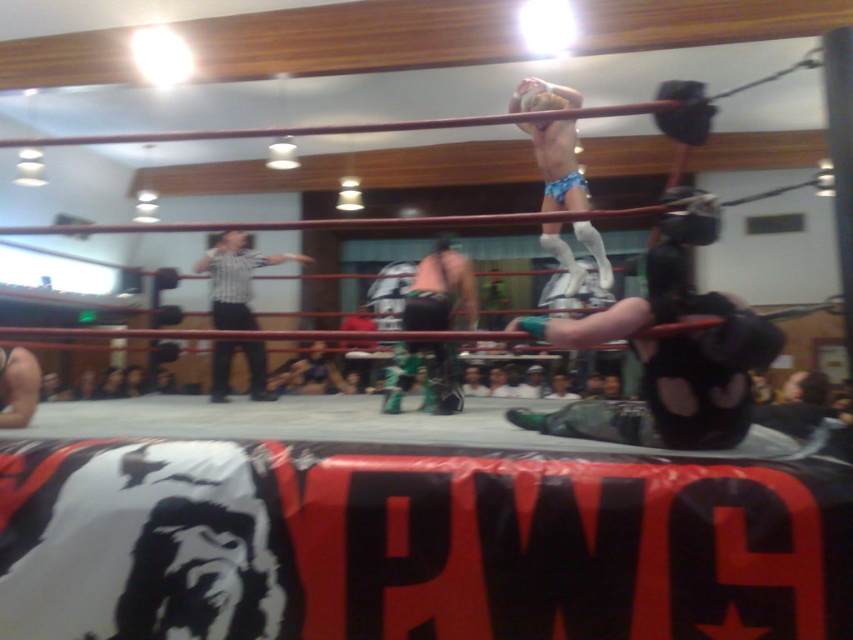
You are a referee in a wrestling match. You see the green fabric pants at center and the striped shirt at center. Which one is positioned higher in the image?

The green fabric pants at center is above the striped shirt at center, so the green fabric pants at center is positioned higher.

You are a referee in a wrestling match and need to determine which wrestler is closer to the ropes. Based on the scene, which wrestler is positioned closer to the ropes between the blue fabric shorts at upper right and the green fabric pants at center?

The blue fabric shorts at upper right is in front of the green fabric pants at center, so the blue fabric shorts at upper right is closer to the ropes.